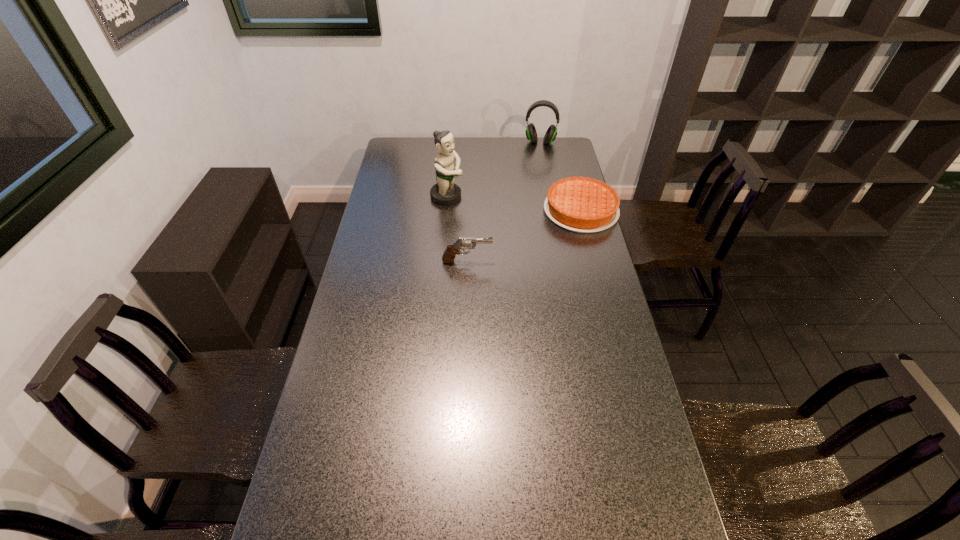
Locate an element on the screen. This screenshot has width=960, height=540. vacant space on the desktop that is between the pistol and the pie and is positioned on the front-facing side of the tallest object is located at coordinates click(535, 232).

The image size is (960, 540). Find the location of `free spot on the desktop that is between the third tallest object and the pie and is positioned on the ear cups of the farthest object`. free spot on the desktop that is between the third tallest object and the pie and is positioned on the ear cups of the farthest object is located at coordinates (533, 232).